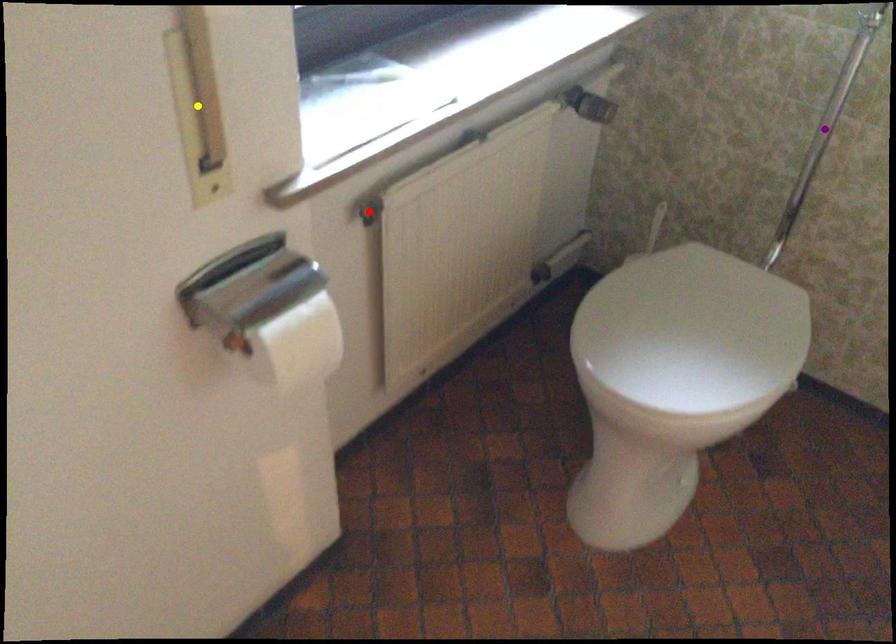
Order these from nearest to farthest:
yellow point
purple point
red point

1. yellow point
2. red point
3. purple point